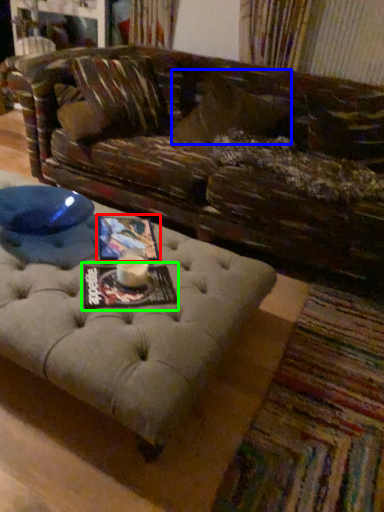
Question: Which is farther away from magazine (highlighted by a red box)? pillow (highlighted by a blue box) or magazine (highlighted by a green box)?

Choices:
 (A) pillow
 (B) magazine

Answer: (A)